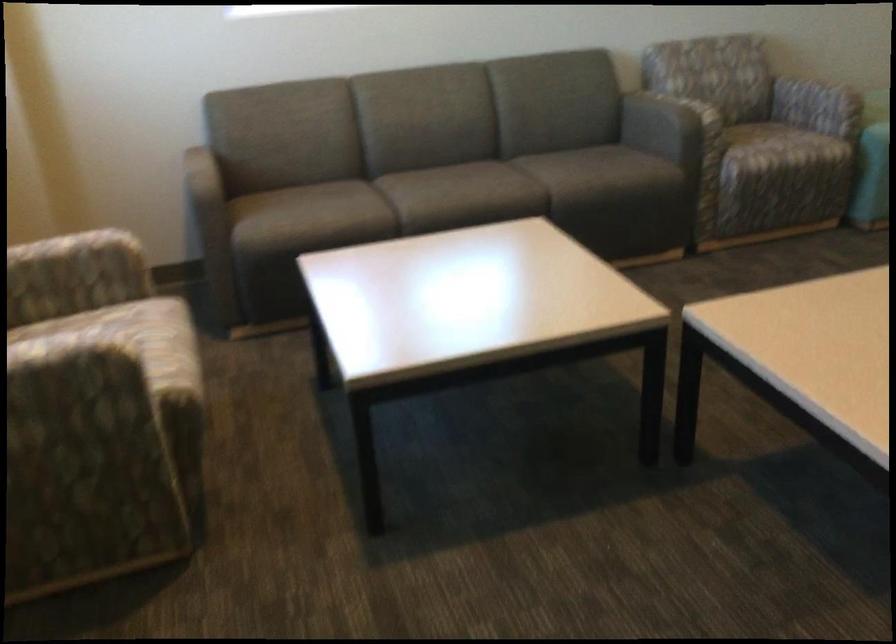
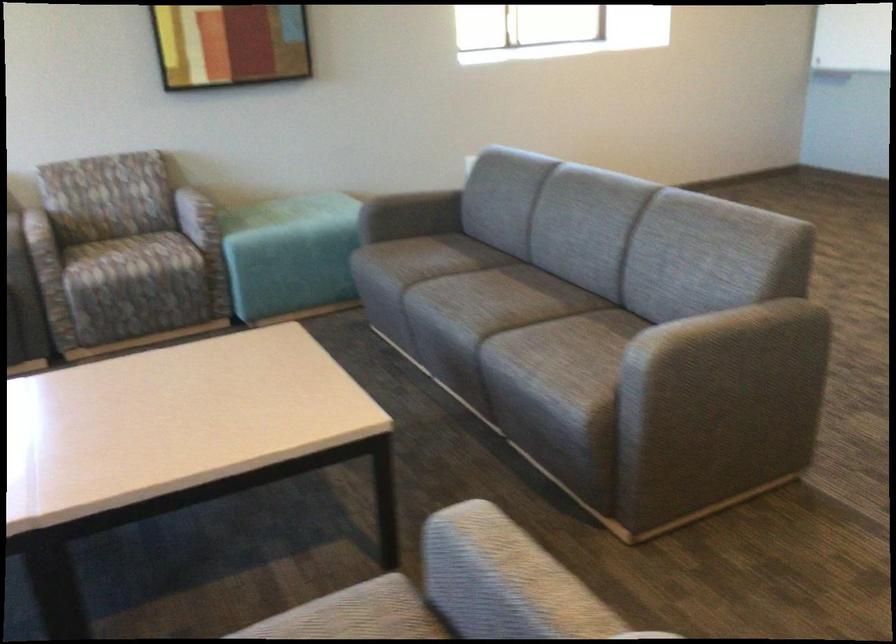
Find the pixel in the second image that matches the point at 824,98 in the first image.

(197, 216)